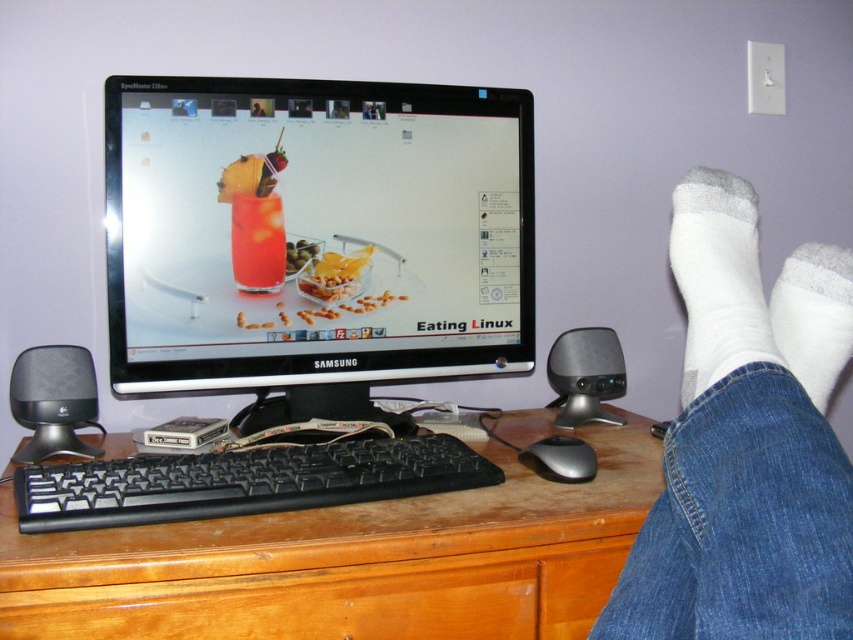
You are setting up a new webcam for a video call and want to place it directly above the black glossy monitor at center. According to the image, where should you position the webcam?

The black glossy monitor at center is located at point (317, 237), so you should position the webcam directly above this coordinate to ensure it is centered and aligned properly.

Consider the image. You are organizing a tech conference and need to ensure that the black glossy monitor at center and the black plastic keyboard at center are visible to the audience. Since the stage has limited vertical space, which object should be placed lower to accommodate both?

The black plastic keyboard at center should be placed lower because the black glossy monitor at center is taller than the black plastic keyboard at center, allowing the monitor to occupy the upper space without exceeding the stage height limit.

You are a robot trying to navigate between two points in a workspace. The first point is at coordinates point (x=254, y=156) and the second point is at coordinates point (x=263, y=488). According to the scene description, which point is closer to the observer?

Point (x=254, y=156) is behind point (x=263, y=488), so the second point is closer to the observer.